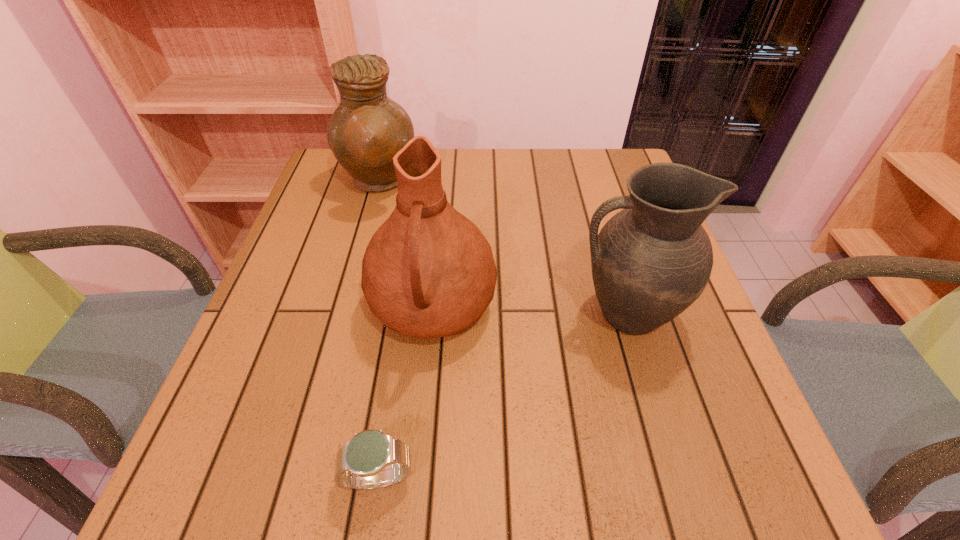
Find the location of a particular element. the farthest pitcher is located at coordinates (367, 129).

Identify the location of the rightmost pitcher. This screenshot has height=540, width=960. (653, 259).

Find the location of a particular element. This screenshot has width=960, height=540. watch is located at coordinates (363, 463).

Identify the location of the shortest object. The image size is (960, 540). (363, 463).

This screenshot has width=960, height=540. I want to click on blank space located 0.250m at the spout of the farthest object, so click(x=509, y=183).

This screenshot has width=960, height=540. I want to click on free space located on the side of the rightmost object with the handle, so click(393, 314).

You are a GUI agent. You are given a task and a screenshot of the screen. Output one action in this format:
    pyautogui.click(x=<x>, y=<y>)
    Task: Click on the free location located 0.250m on the side of the rightmost object with the handle
    This screenshot has width=960, height=540.
    Given the screenshot: What is the action you would take?
    pyautogui.click(x=446, y=314)

At what (x,y) coordinates should I click in order to perform the action: click on vacant position located 0.320m on the side of the rightmost object with the handle. Please return your answer as a coordinate pair (x, y). The height and width of the screenshot is (540, 960). Looking at the image, I should click on (412, 314).

Locate an element on the screen. This screenshot has height=540, width=960. free space located 0.190m on the left of the watch is located at coordinates (217, 478).

The image size is (960, 540). I want to click on object at the far edge, so click(x=367, y=129).